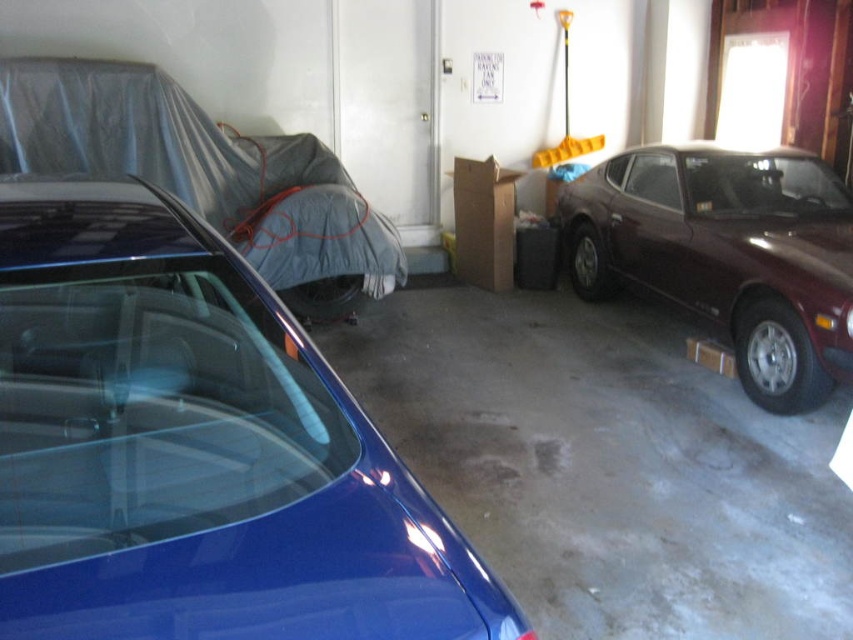
Can you confirm if glossy blue car at center is positioned to the right of maroon metallic car at right?

No, glossy blue car at center is not to the right of maroon metallic car at right.

Is glossy blue car at center below maroon metallic car at right?

Indeed, glossy blue car at center is positioned under maroon metallic car at right.

Does point (76, 632) lie in front of point (668, 268)?

Yes, it is.

Identify the location of glossy blue car at center. The width and height of the screenshot is (853, 640). coord(195,449).